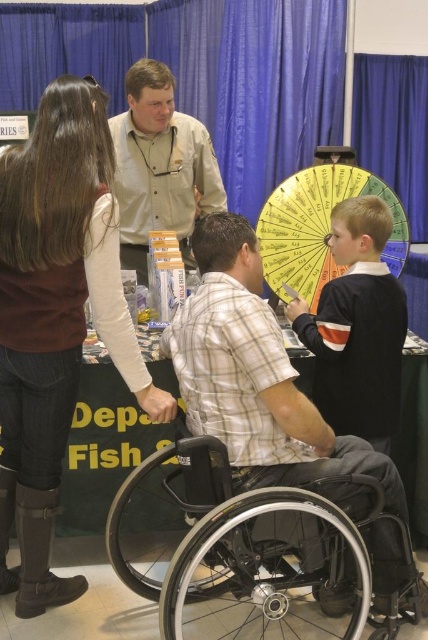
You are a photographer at the event and want to take a photo of the black plastic wheelchair at lower center without including the brown leather boots at lower left in the frame. Is this possible based on their positions?

The brown leather boots at lower left is further to the viewer than the black plastic wheelchair at lower center. Therefore, it would be challenging to capture the black plastic wheelchair at lower center without including the brown leather boots at lower left in the frame since the boots are closer to the photographer.

You are at the Department of Fish event and need to find the dark blue sweater at center. Which direction should you look relative to the brown leather boots at lower left?

The dark blue sweater at center is to the right of the brown leather boots at lower left, so you should look to the right from the brown leather boots at lower left to find it.

You are standing at the center of the image. Where are the brown leather boots at lower left located relative to your position?

The brown leather boots at lower left are located at point (56,320) relative to the image center.